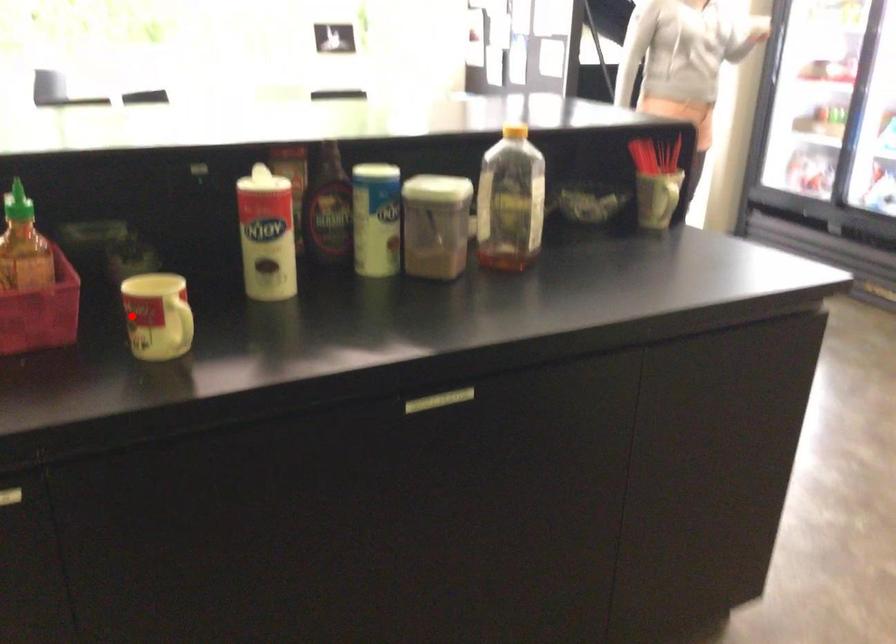
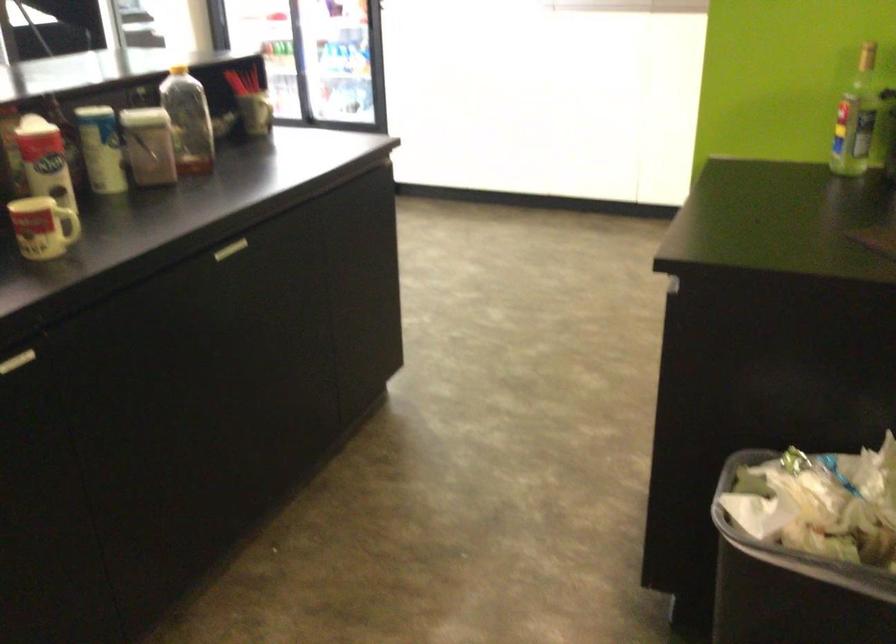
Question: I am providing you with two images of the same scene from different viewpoints. A red point is marked on the first image. Is the red point's position out of view in image 2?

Choices:
 (A) Yes
 (B) No

Answer: (B)